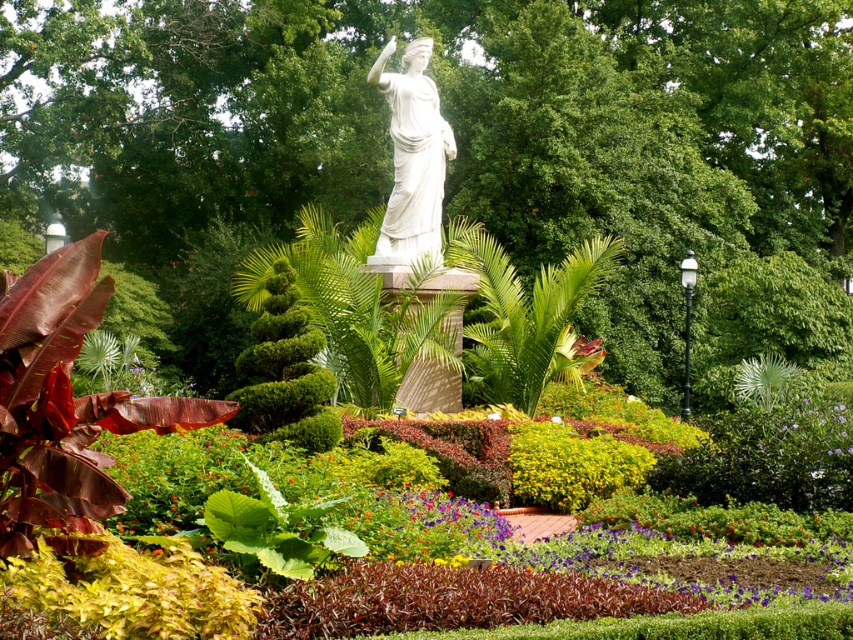
Question: Among these points, which one is nearest to the camera?

Choices:
 (A) (310, 24)
 (B) (395, 182)
 (C) (286, 396)

Answer: (C)

Question: Among these objects, which one is nearest to the camera?

Choices:
 (A) green leafy tree at center
 (B) white marble statue at center
 (C) green textured bush at center

Answer: (C)

Question: Among these objects, which one is farthest from the camera?

Choices:
 (A) green leafy tree at center
 (B) green textured bush at center
 (C) white marble statue at center

Answer: (A)

Question: Does green leafy tree at center have a lesser width compared to green textured bush at center?

Choices:
 (A) yes
 (B) no

Answer: (B)

Question: Does green leafy tree at center appear under white marble statue at center?

Choices:
 (A) no
 (B) yes

Answer: (A)

Question: Is green leafy tree at center above white marble statue at center?

Choices:
 (A) yes
 (B) no

Answer: (A)